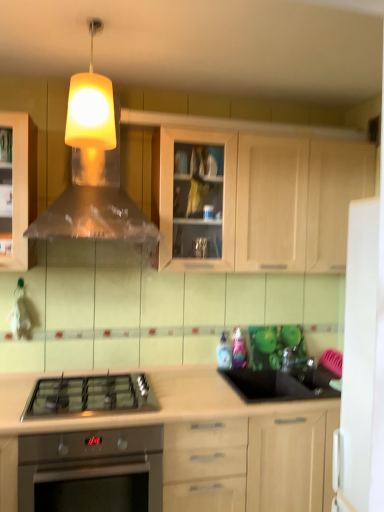
Question: From the image's perspective, is yellow matte lampshade at upper center located beneath light wood cabinet at center, which is the first cabinetry from bottom to top?

Choices:
 (A) yes
 (B) no

Answer: (B)

Question: From a real-world perspective, does yellow matte lampshade at upper center sit lower than light wood cabinet at center, acting as the second cabinetry starting from the top?

Choices:
 (A) yes
 (B) no

Answer: (B)

Question: Would you say light wood cabinet at center, acting as the second cabinetry starting from the top, is part of yellow matte lampshade at upper center's contents?

Choices:
 (A) yes
 (B) no

Answer: (B)

Question: Is yellow matte lampshade at upper center with light wood cabinet at center, acting as the second cabinetry starting from the top?

Choices:
 (A) no
 (B) yes

Answer: (A)

Question: From the image's perspective, would you say yellow matte lampshade at upper center is positioned over light wood cabinet at center, acting as the second cabinetry starting from the top?

Choices:
 (A) no
 (B) yes

Answer: (B)

Question: Is yellow matte lampshade at upper center thinner than light wood cabinet at center, which is the first cabinetry from bottom to top?

Choices:
 (A) no
 (B) yes

Answer: (B)

Question: From a real-world perspective, is stainless steel oven at lower left under light wood cabinet at center, which is the first cabinetry from bottom to top?

Choices:
 (A) yes
 (B) no

Answer: (A)

Question: Is stainless steel oven at lower left positioned before light wood cabinet at center, which is the first cabinetry from bottom to top?

Choices:
 (A) no
 (B) yes

Answer: (A)

Question: Is stainless steel oven at lower left beside light wood cabinet at center, which is the first cabinetry from bottom to top?

Choices:
 (A) no
 (B) yes

Answer: (A)

Question: Can you confirm if stainless steel oven at lower left is shorter than light wood cabinet at center, acting as the second cabinetry starting from the top?

Choices:
 (A) yes
 (B) no

Answer: (A)

Question: Does stainless steel oven at lower left have a smaller size compared to light wood cabinet at center, acting as the second cabinetry starting from the top?

Choices:
 (A) no
 (B) yes

Answer: (B)

Question: Would you say stainless steel oven at lower left is outside light wood cabinet at center, acting as the second cabinetry starting from the top?

Choices:
 (A) yes
 (B) no

Answer: (B)

Question: Considering the relative sizes of stainless steel oven at lower left and satin nickel faucet at right in the image provided, is stainless steel oven at lower left shorter than satin nickel faucet at right?

Choices:
 (A) yes
 (B) no

Answer: (B)